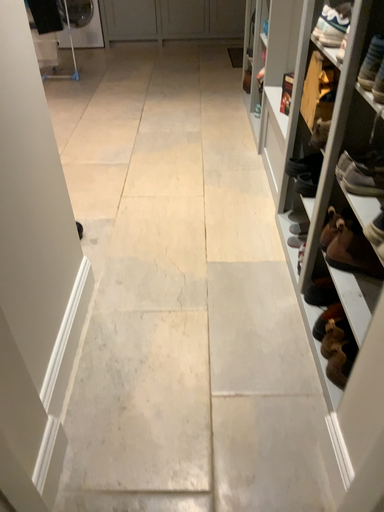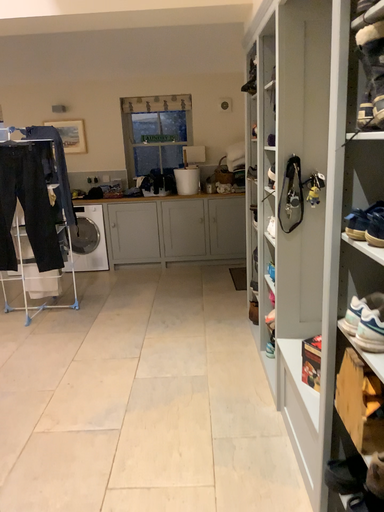
Question: Which way did the camera rotate in the video?

Choices:
 (A) rotated upward
 (B) rotated downward

Answer: (A)